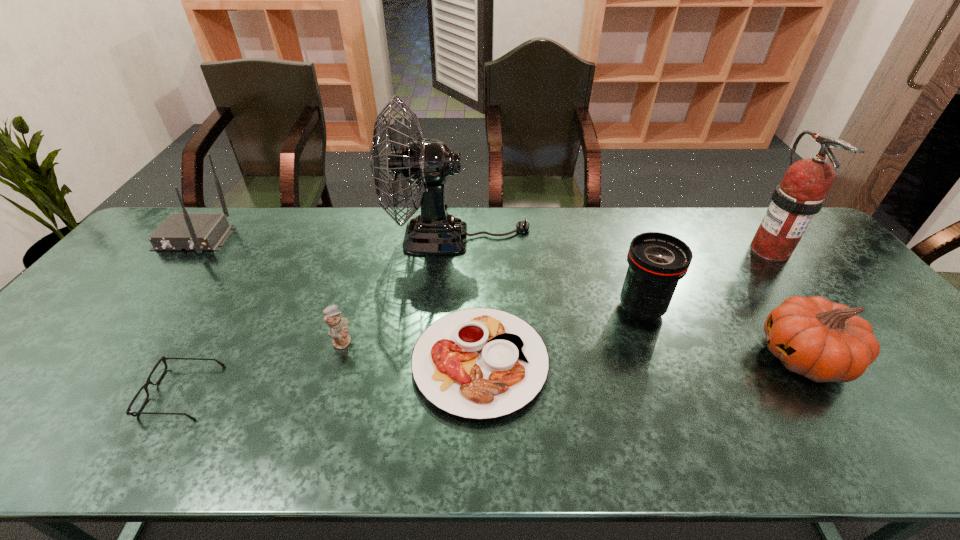
Find the location of a particular element. The image size is (960, 540). free space between the platter and the fan is located at coordinates (469, 300).

Identify the location of empty space between the seventh object from right to left and the platter. (331, 377).

You are a GUI agent. You are given a task and a screenshot of the screen. Output one action in this format:
    pyautogui.click(x=<x>, y=<y>)
    Task: Click on the seventh closest object relative to the spectacles
    
    Given the screenshot: What is the action you would take?
    pyautogui.click(x=801, y=194)

Locate an element on the screen. object that is the sixth nearest to the platter is located at coordinates (198, 232).

Where is `vacant area that satisfies the following two spatial constraints: 1. in front of the fan, indicating the direction of air flow; 2. on the back of the router to connect cables`? This screenshot has width=960, height=540. vacant area that satisfies the following two spatial constraints: 1. in front of the fan, indicating the direction of air flow; 2. on the back of the router to connect cables is located at coordinates (458, 239).

I want to click on blank space that satisfies the following two spatial constraints: 1. on the face of the pumpkin; 2. on the front side of the platter, so click(807, 362).

This screenshot has width=960, height=540. What are the coordinates of `vacant space that satisfies the following two spatial constraints: 1. on the back of the leftmost object to connect cables; 2. on the left side of the platter` in the screenshot? It's located at (96, 362).

This screenshot has width=960, height=540. I want to click on vacant area in the image that satisfies the following two spatial constraints: 1. at the nozzle of the fire extinguisher; 2. on the face of the fifth tallest object, so click(x=854, y=357).

Image resolution: width=960 pixels, height=540 pixels. In order to click on vacant space that satisfies the following two spatial constraints: 1. on the front-facing side of the spectacles; 2. on the back side of the platter in this screenshot , I will do `click(199, 362)`.

Find the location of a particular element. This screenshot has width=960, height=540. free location that satisfies the following two spatial constraints: 1. on the back of the platter to connect cables; 2. on the right side of the router is located at coordinates (96, 362).